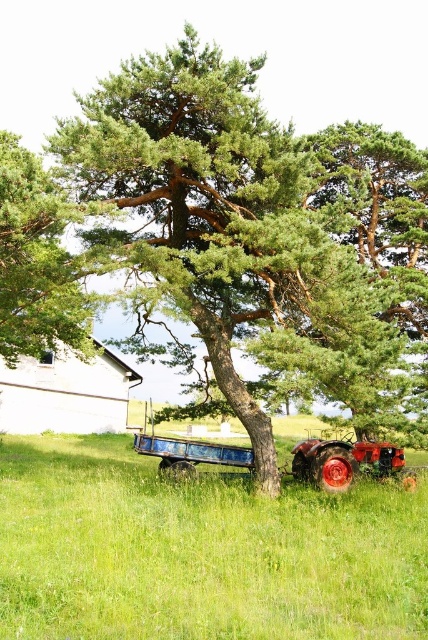
You are standing in the middle of the green grassy field at lower center and want to walk towards the green leafy tree at center. Which direction should you head?

Since the green leafy tree at center is further to the viewer than the green grassy field at lower center, you should walk towards the tree in the direction of where it appears closer to you, which would be forward towards it.

You are a farmer standing at the edge of your field and looking at the green leafy tree at center and the shiny red tractor at center. Which object would block your view if you tried to look over the other one?

The green leafy tree at center is much taller than the shiny red tractor at center, so if you tried to look over the shiny red tractor at center, the tree would block your view. However, if you tried to look over the tree, the tractor would not block your view since it is shorter.

You are a landscape architect designing a new park and want to ensure that the green leafy tree at center and the green grassy field at lower center are proportionally balanced. Based on the scene, which object is wider?

The green leafy tree at center is wider than the green grassy field at lower center according to the description.